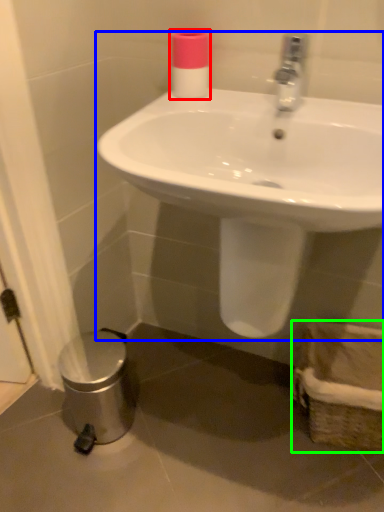
Question: Estimate the real-world distances between objects in this image. Which object is closer to toiletry (highlighted by a red box), sink (highlighted by a blue box) or basket (highlighted by a green box)?

Choices:
 (A) sink
 (B) basket

Answer: (A)